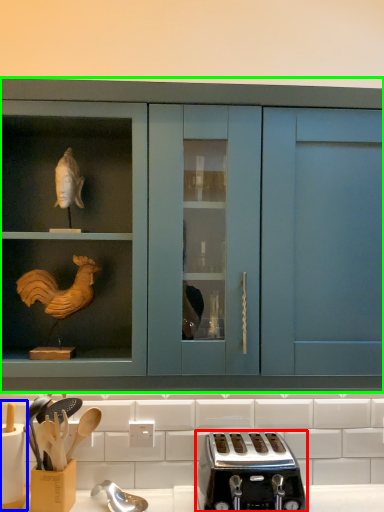
Question: Which object is the farthest from toaster (highlighted by a red box)? Choose among these: appliance (highlighted by a blue box) or cabinetry (highlighted by a green box).

Choices:
 (A) appliance
 (B) cabinetry

Answer: (A)